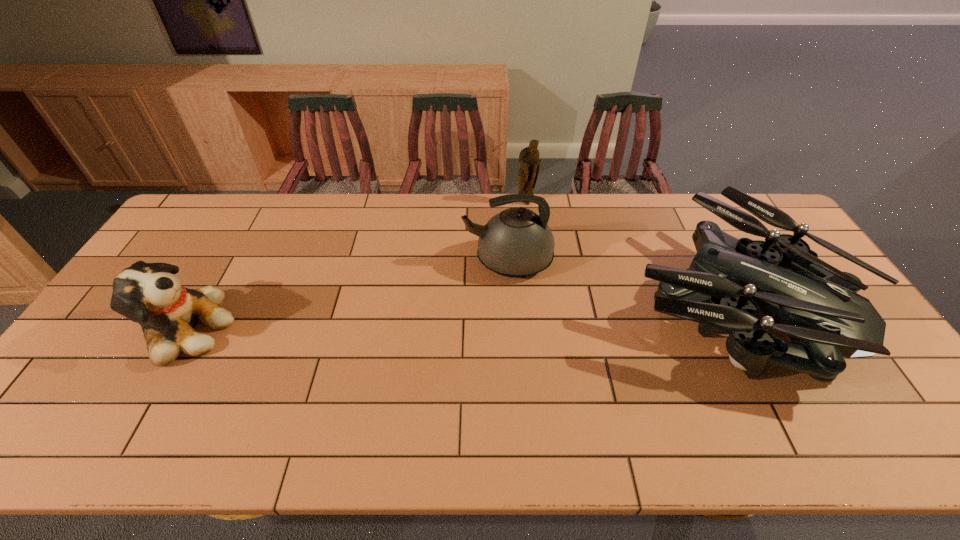
Locate an element on the screen. The height and width of the screenshot is (540, 960). empty space that is in between the kettle and the drone is located at coordinates (619, 281).

Where is `empty space between the figurine and the leftmost object`? empty space between the figurine and the leftmost object is located at coordinates (354, 266).

You are a GUI agent. You are given a task and a screenshot of the screen. Output one action in this format:
    pyautogui.click(x=<x>, y=<y>)
    Task: Click on the vacant area that lies between the rightmost object and the kettle
    Image resolution: width=960 pixels, height=540 pixels.
    Given the screenshot: What is the action you would take?
    pyautogui.click(x=619, y=281)

The width and height of the screenshot is (960, 540). Identify the location of free point between the drone and the kettle. (619, 281).

This screenshot has width=960, height=540. I want to click on free point between the drone and the kettle, so click(619, 281).

Select which object appears as the second closest to the farthest object. Please provide its 2D coordinates. Your answer should be formatted as a tuple, i.e. [(x, y)], where the tuple contains the x and y coordinates of a point satisfying the conditions above.

[(730, 281)]

Select which object is the closest to the kettle. Please provide its 2D coordinates. Your answer should be formatted as a tuple, i.e. [(x, y)], where the tuple contains the x and y coordinates of a point satisfying the conditions above.

[(730, 281)]

Identify the location of free space that satisfies the following two spatial constraints: 1. at the spout of the kettle; 2. on the left side of the rightmost object. (511, 302).

What are the coordinates of `free location that satisfies the following two spatial constraints: 1. on the front-facing side of the figurine; 2. at the spout of the kettle` in the screenshot? It's located at click(x=533, y=261).

Where is `free location that satisfies the following two spatial constraints: 1. on the front-facing side of the figurine; 2. at the spout of the kettle`? The image size is (960, 540). free location that satisfies the following two spatial constraints: 1. on the front-facing side of the figurine; 2. at the spout of the kettle is located at coordinates (533, 261).